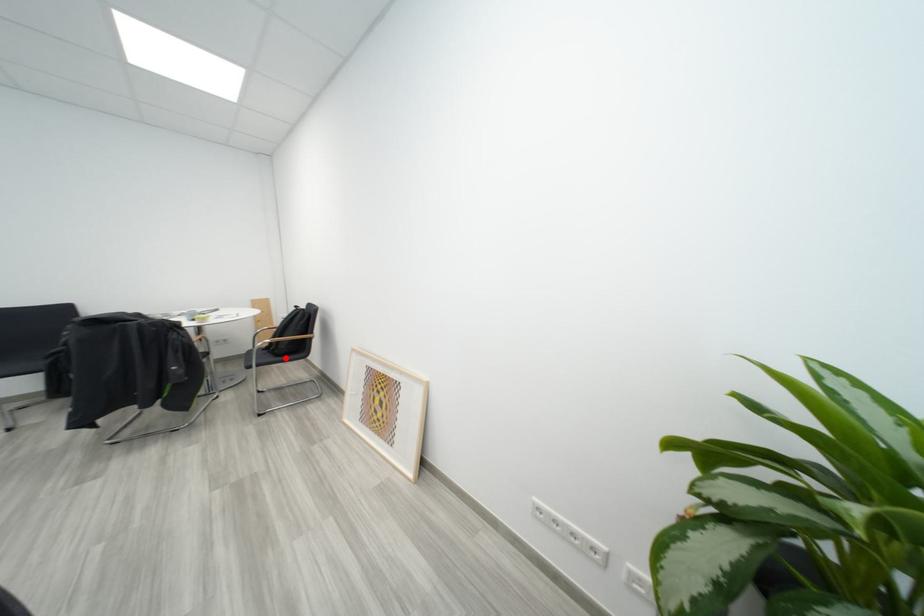
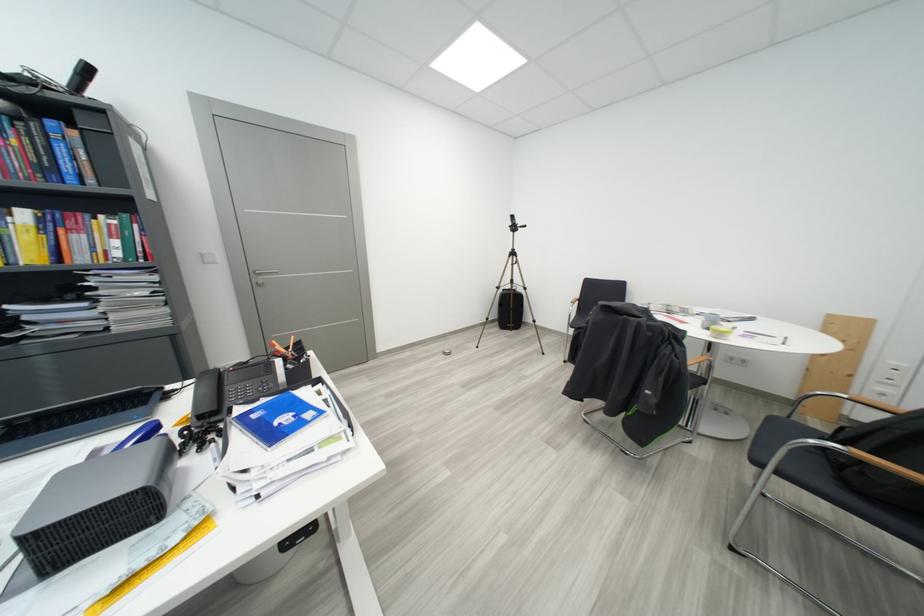
Question: I am providing you with two images of the same scene from different viewpoints. In image1, a red point is highlighted. Considering the same 3D point in image2, which of the following is correct?

Choices:
 (A) It is closer
 (B) It is farther

Answer: (A)